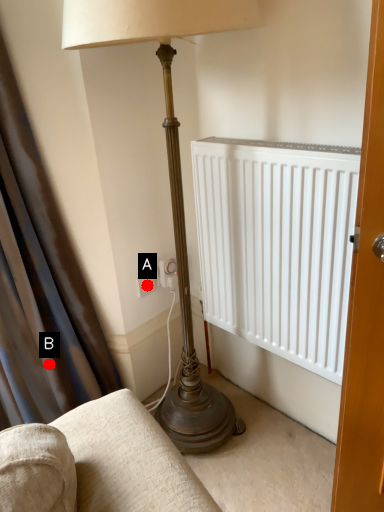
Question: Two points are circled on the image, labeled by A and B beside each circle. Which point is closer to the camera?

Choices:
 (A) A is closer
 (B) B is closer

Answer: (B)